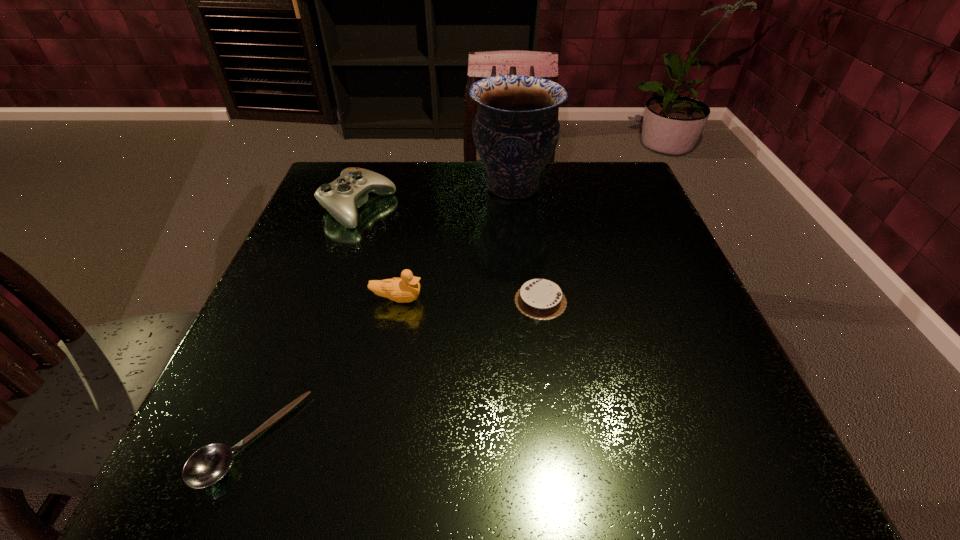
Identify the location of vacant space situated 0.370m on the face of the third object from right to left. This screenshot has height=540, width=960. (628, 299).

Locate an element on the screen. The width and height of the screenshot is (960, 540). free space located on the right of the chocolate cake is located at coordinates (684, 301).

The image size is (960, 540). I want to click on free space located on the right of the nearest object, so click(x=444, y=440).

Identify the location of pottery present at the far edge. The image size is (960, 540). (515, 131).

Where is `control that is positioned at the far edge`? The height and width of the screenshot is (540, 960). control that is positioned at the far edge is located at coordinates (342, 197).

At what (x,y) coordinates should I click in order to perform the action: click on object that is at the near edge. Please return your answer as a coordinate pair (x, y). The image size is (960, 540). Looking at the image, I should click on (209, 464).

Find the location of a particular element. control that is positioned at the left edge is located at coordinates (342, 197).

This screenshot has width=960, height=540. Find the location of `ladle at the left edge`. ladle at the left edge is located at coordinates (209, 464).

Identify the location of object present at the far left corner. (x=342, y=197).

Where is `object that is at the near left corner`? object that is at the near left corner is located at coordinates (209, 464).